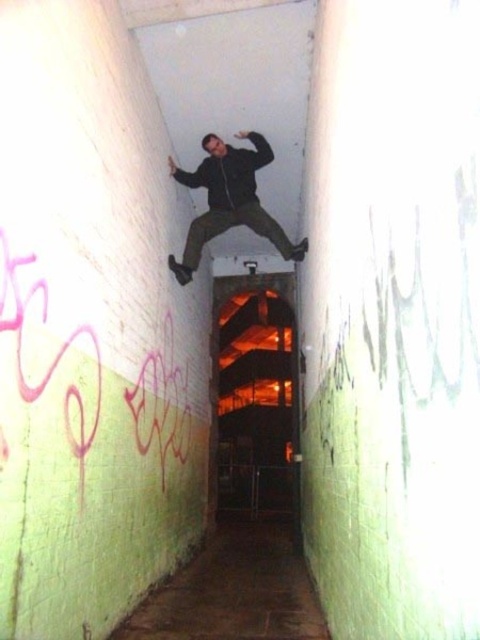
You are standing in the corridor and want to take a photo of the pink graffiti at left and the matte black jacket at center. Which object should you focus on first to ensure both are in sharp focus?

The pink graffiti at left is closer to the viewer than the matte black jacket at center. To ensure both are in sharp focus, focus on the pink graffiti at left since it is the closer object.